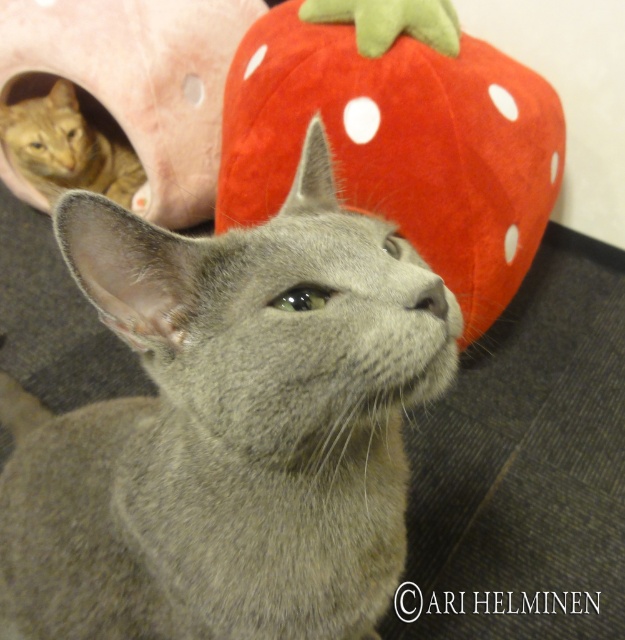
You are standing in front of the image and want to determine which of the two points, point (508, 259) or point (121, 1), is nearer to you. Based on the spatial arrangement in the scene, which point is closer?

Point (508, 259) is closer to the viewer than point (121, 1).

You are a small toy mouse that wants to jump from the orange tabby cat at left to the velvety red strawberry at upper center. Considering their heights, will you need to jump upwards or downwards?

The velvety red strawberry at upper center is much taller than the orange tabby cat at left, so you will need to jump upwards to reach it.